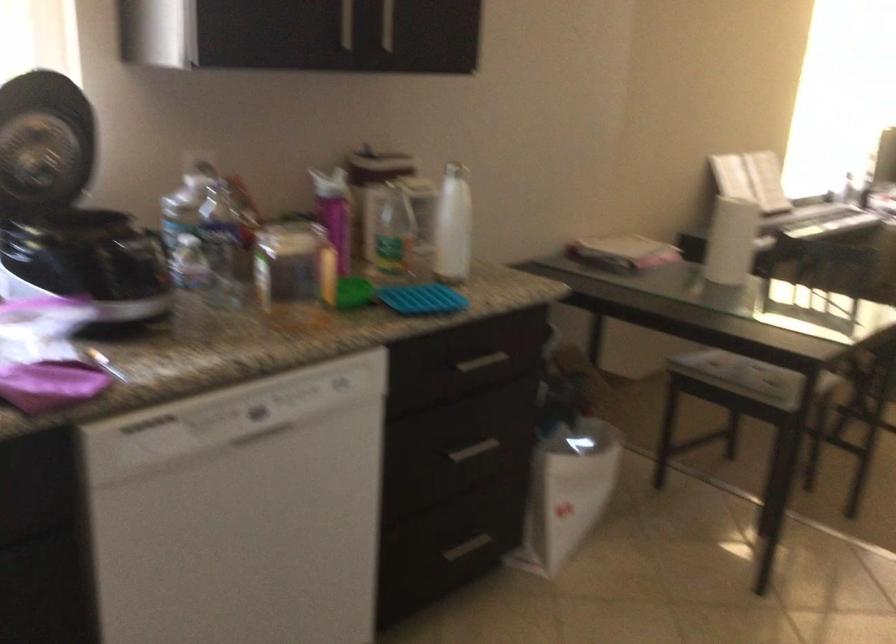
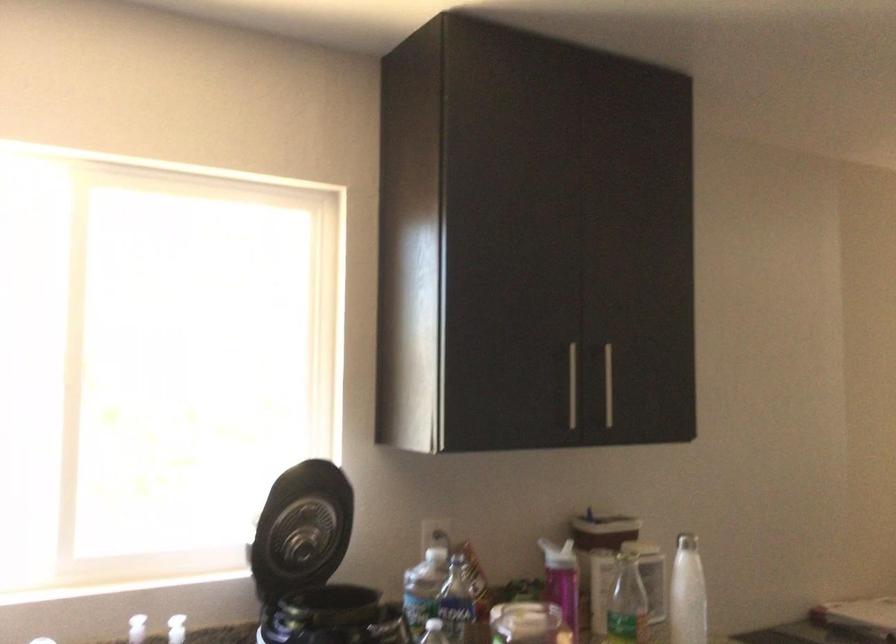
Find the pixel in the second image that matches point 449,219 in the first image.

(687, 592)